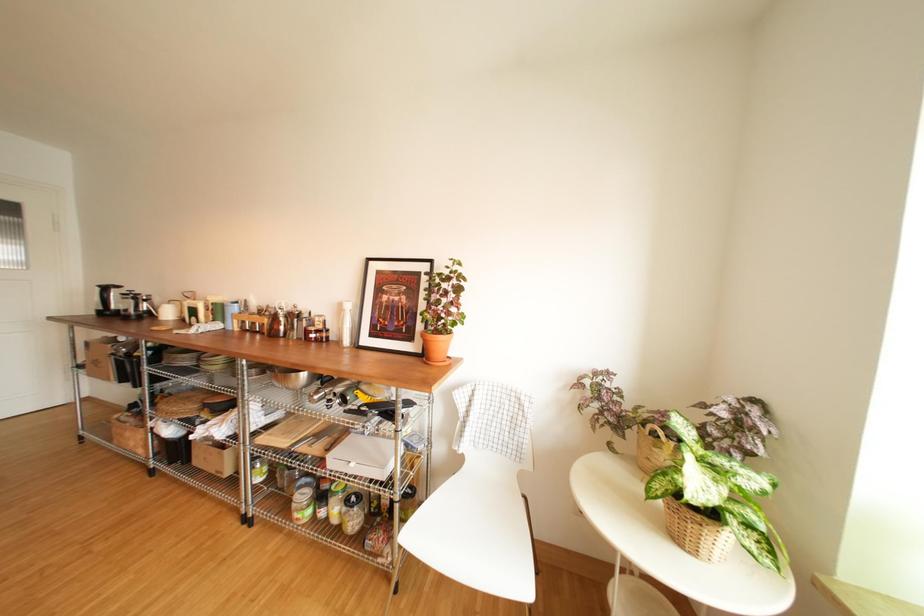
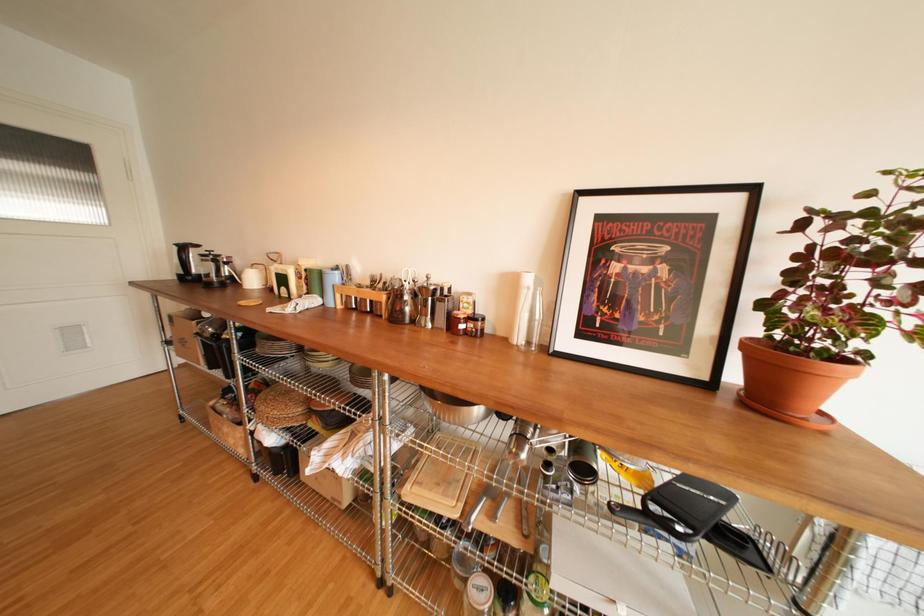
Which direction would the cameraman need to move to produce the second image?

The cameraman walked toward left, forward.